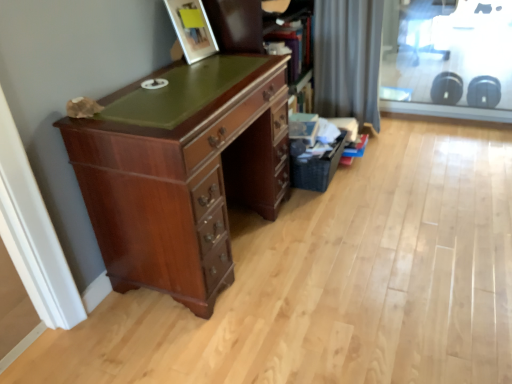
Question: Choose the correct answer: Is gray fabric curtain at upper right inside wooden bookshelf at upper center or outside it?

Choices:
 (A) inside
 (B) outside

Answer: (B)

Question: Looking at their shapes, would you say gray fabric curtain at upper right is wider or thinner than wooden bookshelf at upper center?

Choices:
 (A) thin
 (B) wide

Answer: (B)

Question: Which object is the closest to the gray fabric curtain at upper right?

Choices:
 (A) mahogany wood desk at left
 (B) wooden bookshelf at upper center
 (C) transparent glass screen door at upper right
 (D) black woven basket at lower right
 (E) matte wood picture frame at upper center

Answer: (B)

Question: Which object is the closest to the mahogany wood desk at left?

Choices:
 (A) matte wood picture frame at upper center
 (B) black woven basket at lower right
 (C) gray fabric curtain at upper right
 (D) transparent glass screen door at upper right
 (E) wooden bookshelf at upper center

Answer: (A)